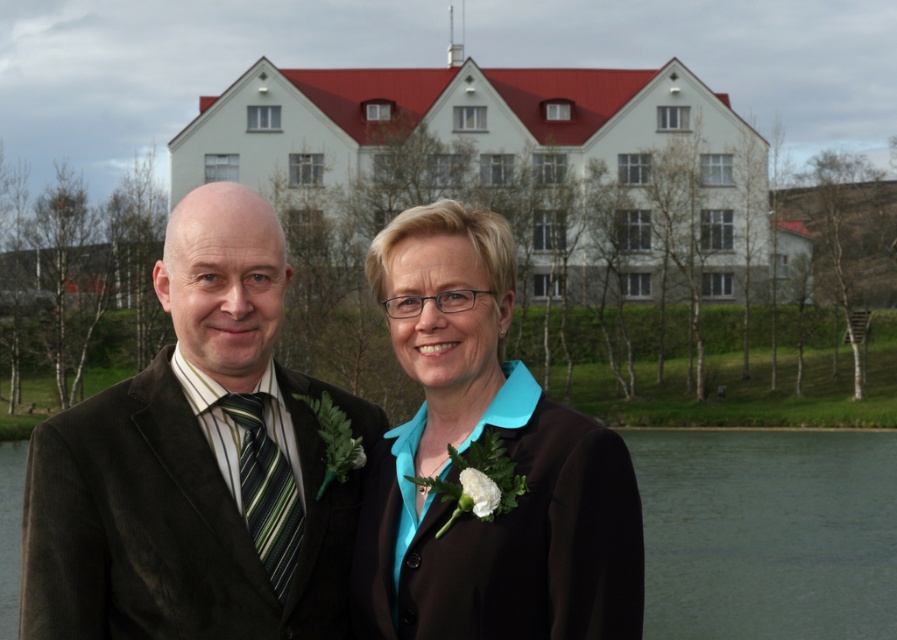
Question: Which of the following is the farthest from the observer?

Choices:
 (A) 807,518
 (B) 486,582
 (C) 248,502

Answer: (A)

Question: Can you confirm if transparent water at lower center is wider than green striped tie at left?

Choices:
 (A) yes
 (B) no

Answer: (A)

Question: Which of the following is the closest to the observer?

Choices:
 (A) green striped tie at left
 (B) transparent water at lower center
 (C) brown corduroy suit at left

Answer: (C)

Question: Is brown corduroy suit at left below teal matte blazer at center?

Choices:
 (A) yes
 (B) no

Answer: (A)

Question: Is teal matte blazer at center positioned behind transparent water at lower center?

Choices:
 (A) no
 (B) yes

Answer: (A)

Question: Estimate the real-world distances between objects in this image. Which object is closer to the transparent water at lower center?

Choices:
 (A) green striped tie at left
 (B) brown corduroy suit at left

Answer: (A)